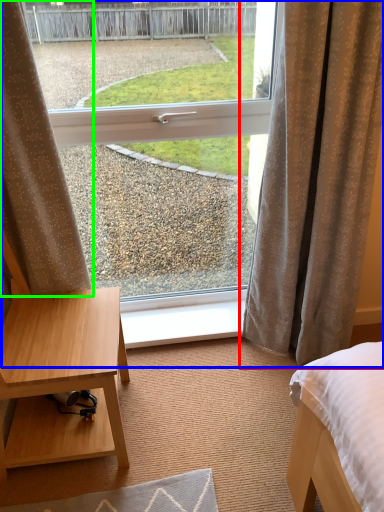
Question: Which is farther away from curtain (highlighted by a red box)? window (highlighted by a blue box) or curtain (highlighted by a green box)?

Choices:
 (A) window
 (B) curtain

Answer: (B)